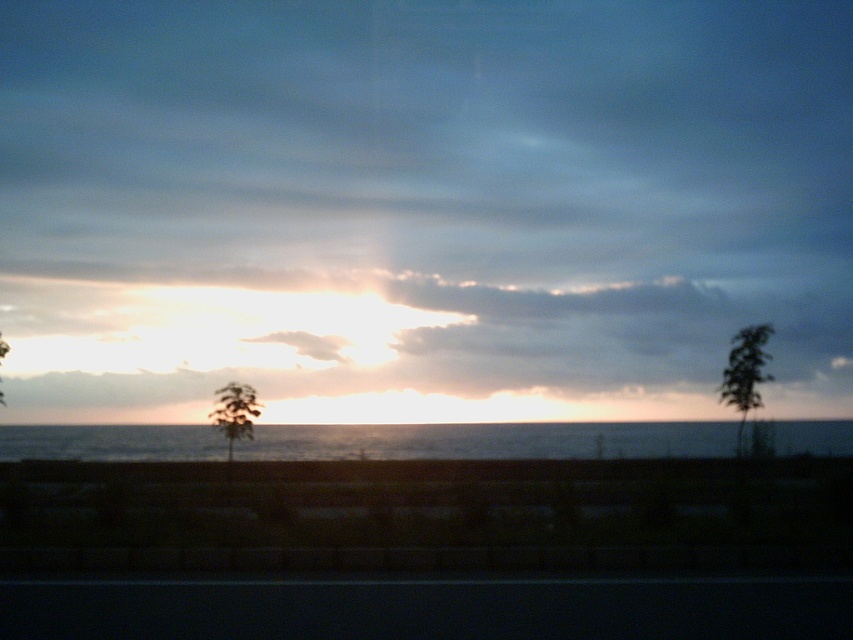
Question: Among these objects, which one is nearest to the camera?

Choices:
 (A) green leafy tree at left
 (B) green leafy tree at right
 (C) green leafy tree at center

Answer: (C)

Question: Can you confirm if smokey gray cloud at upper center is wider than golden translucent clouds at center?

Choices:
 (A) yes
 (B) no

Answer: (A)

Question: Can you confirm if golden translucent clouds at center is positioned above green leafy tree at center?

Choices:
 (A) yes
 (B) no

Answer: (A)

Question: Which point is farther to the camera?

Choices:
 (A) (257, 403)
 (B) (669, 323)
 (C) (737, 346)
 (D) (480, 432)

Answer: (B)

Question: Which point is closer to the camera?

Choices:
 (A) golden translucent clouds at center
 (B) green leafy tree at center

Answer: (B)

Question: Is blue water at center to the left of green leafy tree at center from the viewer's perspective?

Choices:
 (A) no
 (B) yes

Answer: (A)